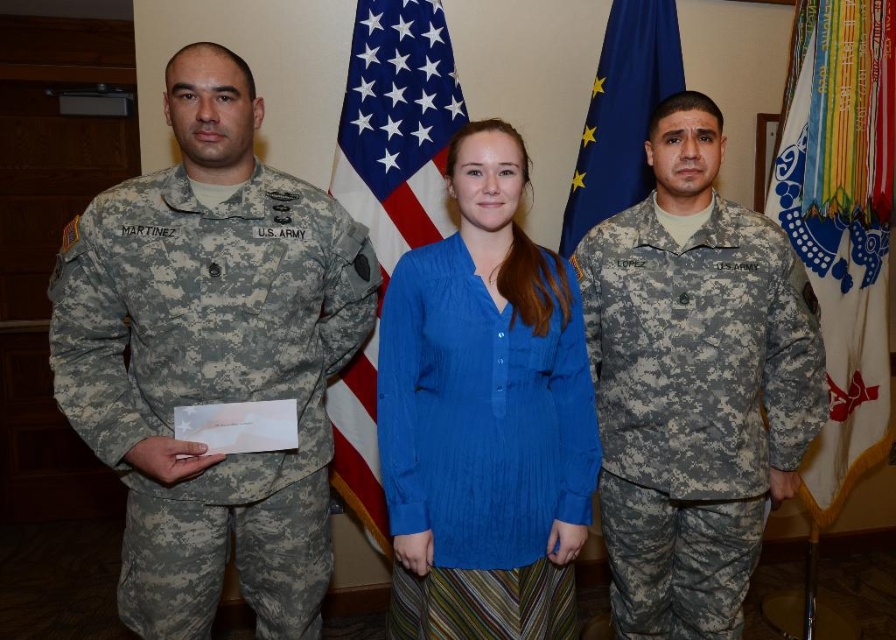
Who is taller, camouflage fabric uniform at left or american flag at center?

american flag at center

Does camouflage fabric uniform at left appear on the left side of american flag at center?

Correct, you'll find camouflage fabric uniform at left to the left of american flag at center.

Identify the location of camouflage fabric uniform at left. (211, 381).

Can you confirm if camouflage fabric uniform at right is taller than american flag at center?

No.

Who is positioned more to the right, camouflage fabric uniform at right or american flag at center?

camouflage fabric uniform at right

The height and width of the screenshot is (640, 896). I want to click on camouflage fabric uniform at right, so click(694, 404).

Find the location of a particular element. This screenshot has height=640, width=896. camouflage fabric uniform at right is located at coordinates (694, 404).

Can you confirm if white fabric flag at right is positioned above blue fabric flag at center?

No, white fabric flag at right is not above blue fabric flag at center.

Does point (823, 266) come closer to viewer compared to point (607, 72)?

No, it is not.

This screenshot has height=640, width=896. I want to click on white fabric flag at right, so click(x=833, y=292).